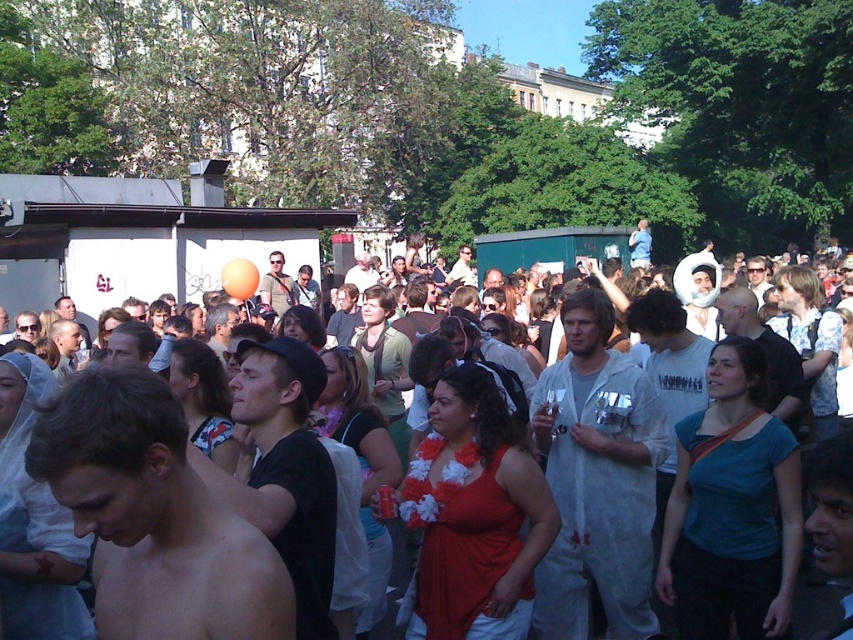
Question: Does white paper suit at center appear on the right side of white cotton shirt at center?

Choices:
 (A) yes
 (B) no

Answer: (A)

Question: Can you confirm if shiny skin at center is smaller than white cotton shirt at center?

Choices:
 (A) yes
 (B) no

Answer: (A)

Question: Which of the following is the closest to the observer?

Choices:
 (A) (155, 429)
 (B) (312, 556)
 (C) (817, 621)

Answer: (A)

Question: Which point is closer to the camera taking this photo?

Choices:
 (A) (374, 276)
 (B) (289, 292)

Answer: (B)

Question: Is black matte shirt at center above light blue shirt at center?

Choices:
 (A) yes
 (B) no

Answer: (B)

Question: Based on their relative distances, which object is farther from the light blue shirt at center?

Choices:
 (A) white paper suit at center
 (B) shiny black shirt at center
 (C) matte khaki shirt at center

Answer: (A)